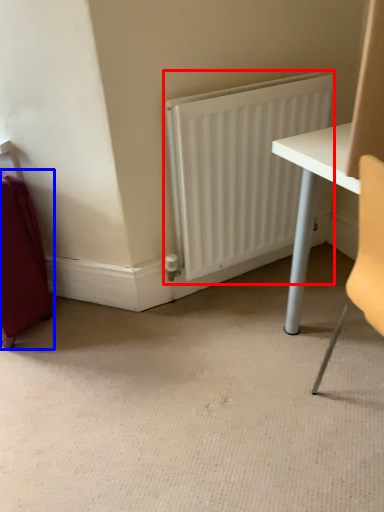
Question: Which of the following is the closest to the observer, radiator (highlighted by a red box) or luggage (highlighted by a blue box)?

Choices:
 (A) radiator
 (B) luggage

Answer: (B)